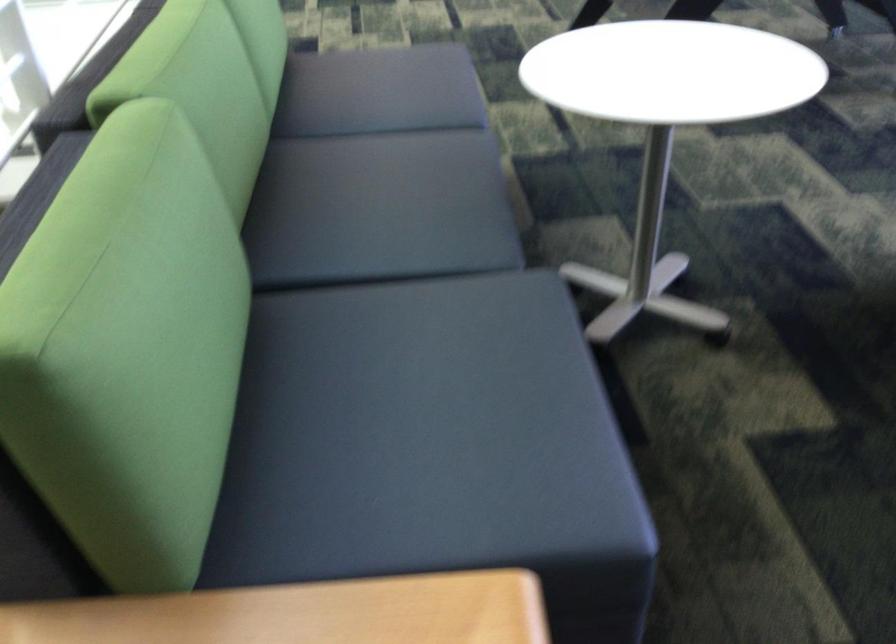
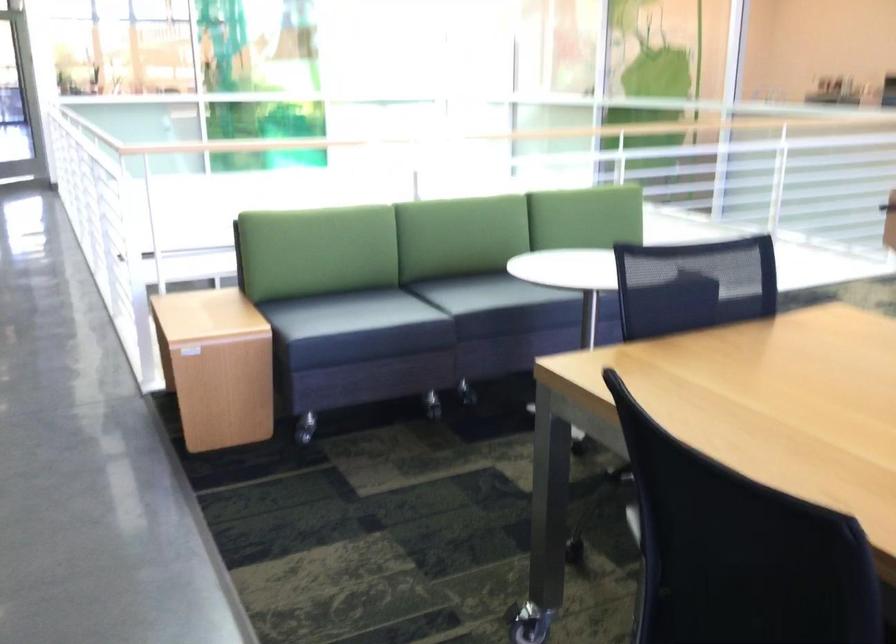
Locate, in the second image, the point that corresponds to the point at 481,162 in the first image.

(488, 292)